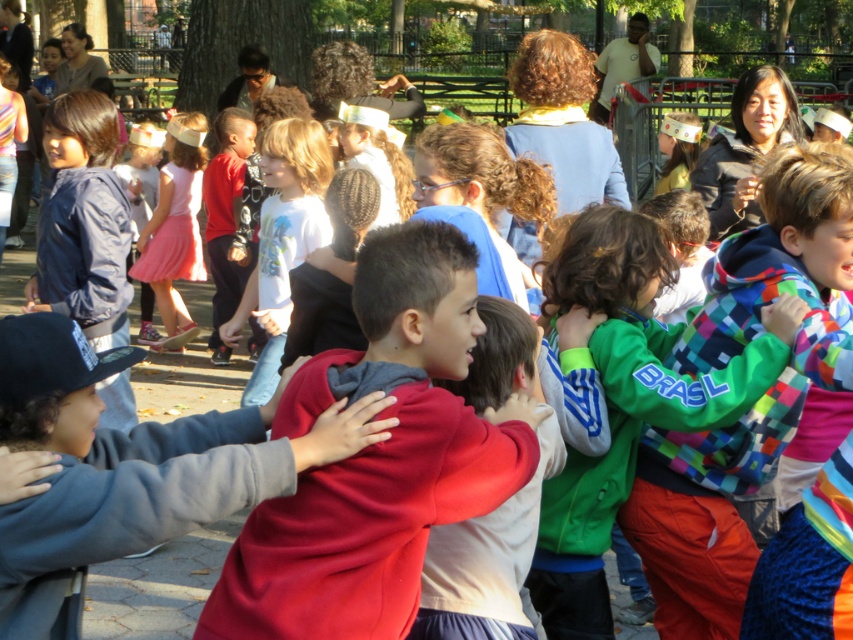
You are a photographer at the event and need to arrange the white matte shirt at center and the pink satin dress at center for a group photo. Which should be placed to the left to maintain their original positions?

The pink satin dress at center should be placed to the left because the white matte shirt at center is originally positioned on the right side of the pink satin dress at center.

You are standing at the origin point of the coordinate system in the image. You want to locate the white matte shirt at center. In which direction should you move to reach it?

The white matte shirt at center is located at coordinate point 0.377 in the x direction and 0.332 in the y direction. Since you are at the origin, you should move towards the positive x and positive y directions to reach it.